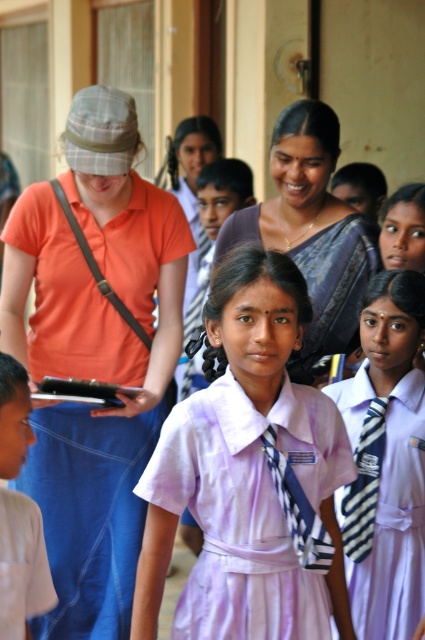
You are a photographer adjusting your camera settings to focus on the purple school uniform at center and the blue striped tie at center. Which object should you adjust your focus on first if you want to ensure both are in focus, considering their sizes?

The purple school uniform at center is taller than the blue striped tie at center, so you should focus on the purple school uniform at center first to ensure both are in focus.

You are standing in a school hallway and see the purple silk saree at center. If you want to get closer to it, how many steps would you need to take if each step covers 0.75 meters?

The distance between the viewer and the purple silk saree at center is 4.45 meters. Each step covers 0.75 meters, so dividing 4.45 by 0.75 gives approximately 5.93 steps. Since you can only take whole steps, you would need to take 6 steps to reach the purple silk saree at center.